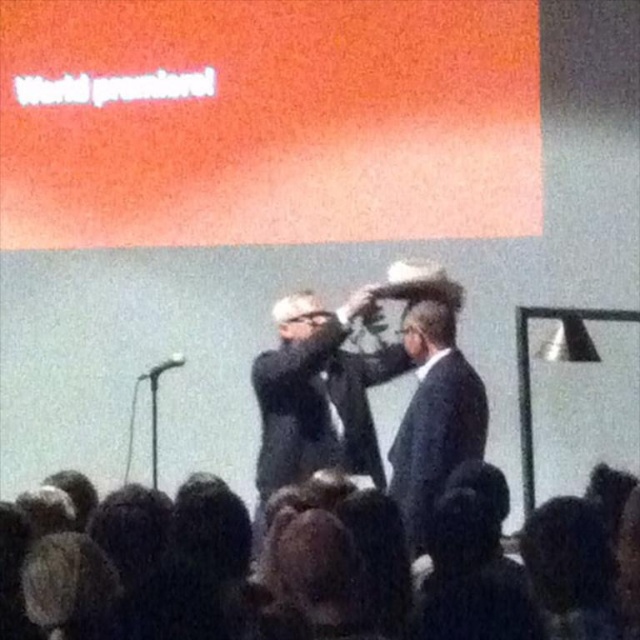
You are an event planner at the conference. You need to ensure that all microphones are visible to the audience. The dark hair at lower center and the satin black suit at center are both on stage. Which one is shorter in height?

The dark hair at lower center has a lesser height compared to the satin black suit at center, so the dark hair at lower center is shorter in height.

You are an event planner trying to set up a microphone stand between the dark hair at lower center and the black suit at center. The microphone stand requires at least 30 inches of space to be placed safely. Can you fit it between them?

The dark hair at lower center and the black suit at center are 35.26 inches apart, which is more than the required 30 inches. Therefore, the microphone stand can be safely placed between them.

You are attending a conference and see two people on stage. One is pointing towards the point marked as point [208,576]. Where is this point located relative to the dark hair at lower center?

The point [208,576] is the location of the dark hair at lower center.